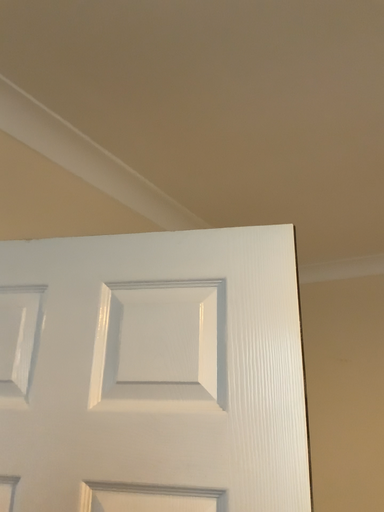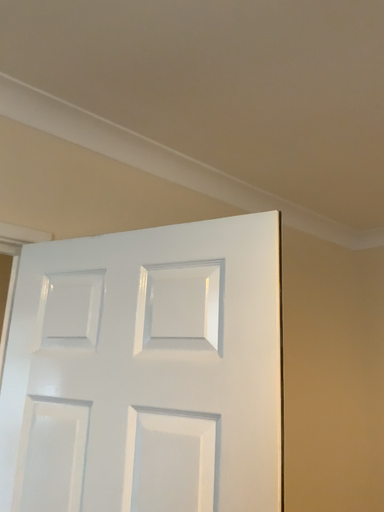
Question: How did the camera likely rotate when shooting the video?

Choices:
 (A) rotated left
 (B) rotated right

Answer: (A)